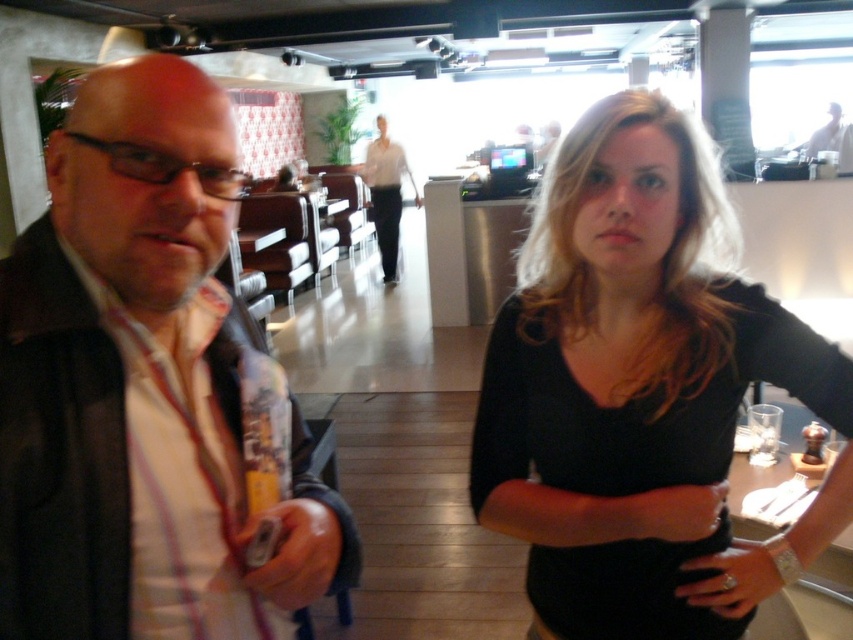
Is black matte shirt at center taller than matte white blouse at center?

Incorrect, black matte shirt at center's height is not larger of matte white blouse at center's.

Does black matte shirt at center have a greater width compared to matte white blouse at center?

Incorrect, black matte shirt at center's width does not surpass matte white blouse at center's.

This screenshot has height=640, width=853. Describe the element at coordinates (640, 392) in the screenshot. I see `black matte shirt at center` at that location.

Locate an element on the screen. black matte shirt at center is located at coordinates (640, 392).

Between matte black jacket at left and matte white blouse at center, which one is positioned higher?

Positioned higher is matte white blouse at center.

What do you see at coordinates (148, 390) in the screenshot? The width and height of the screenshot is (853, 640). I see `matte black jacket at left` at bounding box center [148, 390].

Describe the element at coordinates (148, 390) in the screenshot. The width and height of the screenshot is (853, 640). I see `matte black jacket at left` at that location.

Locate an element on the screen. matte black jacket at left is located at coordinates (148, 390).

Can you confirm if matte black jacket at left is bigger than black matte shirt at center?

No.

Does matte black jacket at left have a greater width compared to black matte shirt at center?

No, matte black jacket at left is not wider than black matte shirt at center.

Where is `matte black jacket at left`? matte black jacket at left is located at coordinates (148, 390).

The height and width of the screenshot is (640, 853). I want to click on matte black jacket at left, so click(148, 390).